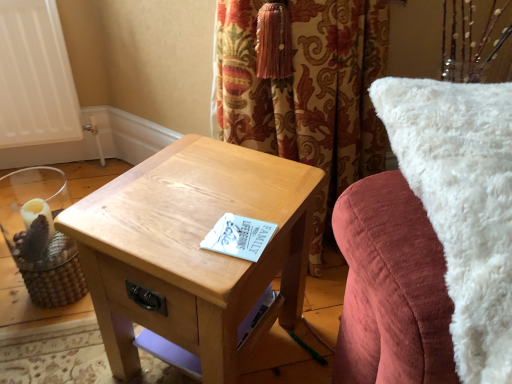
In order to face white fluffy pillow at upper right, should I rotate leftwards or rightwards?

To align with it, rotate right about 32.723°.

The image size is (512, 384). Describe the element at coordinates (40, 235) in the screenshot. I see `woven wood candle holder at left` at that location.

This screenshot has height=384, width=512. Describe the element at coordinates (193, 250) in the screenshot. I see `light brown wood table at center` at that location.

Locate an element on the screen. white fluffy pillow at upper right is located at coordinates (431, 241).

Based on the photo, can you confirm if woven wood candle holder at left is wider than light brown wood table at center?

No.

Considering the sizes of objects woven wood candle holder at left and light brown wood table at center in the image provided, who is taller, woven wood candle holder at left or light brown wood table at center?

light brown wood table at center.

Considering the relative positions of woven wood candle holder at left and light brown wood table at center in the image provided, is woven wood candle holder at left to the left or to the right of light brown wood table at center?

woven wood candle holder at left is to the left of light brown wood table at center.

What's the angular difference between woven wood candle holder at left and light brown wood table at center's facing directions?

There is a 44-degree angle between the facing directions of woven wood candle holder at left and light brown wood table at center.

Is white fluffy pillow at upper right looking in the opposite direction of woven wood candle holder at left?

No, woven wood candle holder at left is not at the back of white fluffy pillow at upper right.

Is white fluffy pillow at upper right thinner than woven wood candle holder at left?

In fact, white fluffy pillow at upper right might be wider than woven wood candle holder at left.

Between white fluffy pillow at upper right and woven wood candle holder at left, which one has larger size?

Bigger between the two is white fluffy pillow at upper right.

In order to click on candle holder behind the white fluffy pillow at upper right in this screenshot , I will do `click(40, 235)`.

Considering the sizes of objects light brown wood table at center and woven wood candle holder at left in the image provided, who is thinner, light brown wood table at center or woven wood candle holder at left?

With smaller width is woven wood candle holder at left.

Considering the sizes of objects light brown wood table at center and woven wood candle holder at left in the image provided, who is taller, light brown wood table at center or woven wood candle holder at left?

With more height is light brown wood table at center.

Which of these two, light brown wood table at center or woven wood candle holder at left, is bigger?

Bigger between the two is light brown wood table at center.

Can you confirm if light brown wood table at center is positioned to the right of woven wood candle holder at left?

Indeed, light brown wood table at center is positioned on the right side of woven wood candle holder at left.

From a real-world perspective, which object stands above the other?

white fluffy pillow at upper right.

Would you say white fluffy pillow at upper right is part of woven wood candle holder at left's contents?

No, white fluffy pillow at upper right is not surrounded by woven wood candle holder at left.

Locate an element on the screen. The width and height of the screenshot is (512, 384). candle holder on the left of white fluffy pillow at upper right is located at coordinates (40, 235).

I want to click on table below the white fluffy pillow at upper right (from a real-world perspective), so click(193, 250).

Between light brown wood table at center and white fluffy pillow at upper right, which one has more height?

Standing taller between the two is white fluffy pillow at upper right.

Visually, is light brown wood table at center positioned to the left or to the right of white fluffy pillow at upper right?

From the image, it's evident that light brown wood table at center is to the left of white fluffy pillow at upper right.

Is light brown wood table at center in front of white fluffy pillow at upper right?

No, it is behind white fluffy pillow at upper right.

This screenshot has width=512, height=384. Identify the location of furniture above the light brown wood table at center (from the image's perspective). (431, 241).

Considering the sizes of objects white fluffy pillow at upper right and light brown wood table at center in the image provided, who is thinner, white fluffy pillow at upper right or light brown wood table at center?

Thinner between the two is light brown wood table at center.

From a real-world perspective, who is located higher, white fluffy pillow at upper right or light brown wood table at center?

white fluffy pillow at upper right, from a real-world perspective.

Would you say white fluffy pillow at upper right contains light brown wood table at center?

No, light brown wood table at center is not surrounded by white fluffy pillow at upper right.

Locate an element on the screen. The image size is (512, 384). candle holder below the light brown wood table at center (from a real-world perspective) is located at coordinates (40, 235).

In the image, there is a white fluffy pillow at upper right. At what (x,y) coordinates should I click in order to perform the action: click on candle holder below it (from the image's perspective). Please return your answer as a coordinate pair (x, y). The width and height of the screenshot is (512, 384). Looking at the image, I should click on (40, 235).

From the image, which object appears to be farther from light brown wood table at center, white fluffy pillow at upper right or woven wood candle holder at left?

Based on the image, woven wood candle holder at left appears to be further to light brown wood table at center.

Considering their positions, is woven wood candle holder at left positioned further to light brown wood table at center than white fluffy pillow at upper right?

woven wood candle holder at left is positioned further to the anchor light brown wood table at center.

When comparing their distances from woven wood candle holder at left, does white fluffy pillow at upper right or light brown wood table at center seem further?

Based on the image, white fluffy pillow at upper right appears to be further to woven wood candle holder at left.

Based on their spatial positions, is woven wood candle holder at left or light brown wood table at center closer to white fluffy pillow at upper right?

Based on the image, light brown wood table at center appears to be nearer to white fluffy pillow at upper right.

Which object lies further to the anchor point woven wood candle holder at left, light brown wood table at center or white fluffy pillow at upper right?

white fluffy pillow at upper right is further to woven wood candle holder at left.

Which object lies nearer to the anchor point white fluffy pillow at upper right, light brown wood table at center or woven wood candle holder at left?

Among the two, light brown wood table at center is located nearer to white fluffy pillow at upper right.

Locate an element on the screen. The width and height of the screenshot is (512, 384). table between woven wood candle holder at left and white fluffy pillow at upper right from left to right is located at coordinates (193, 250).